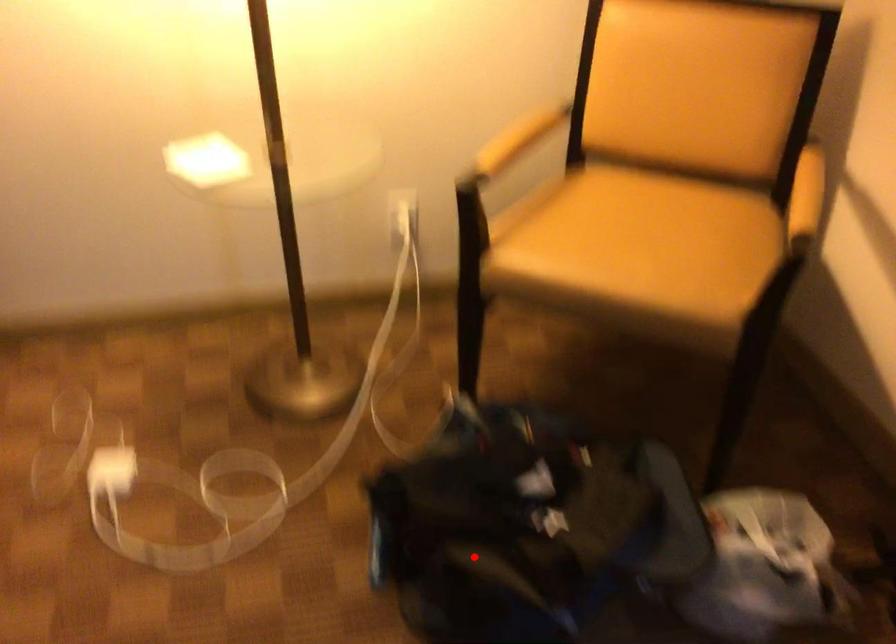
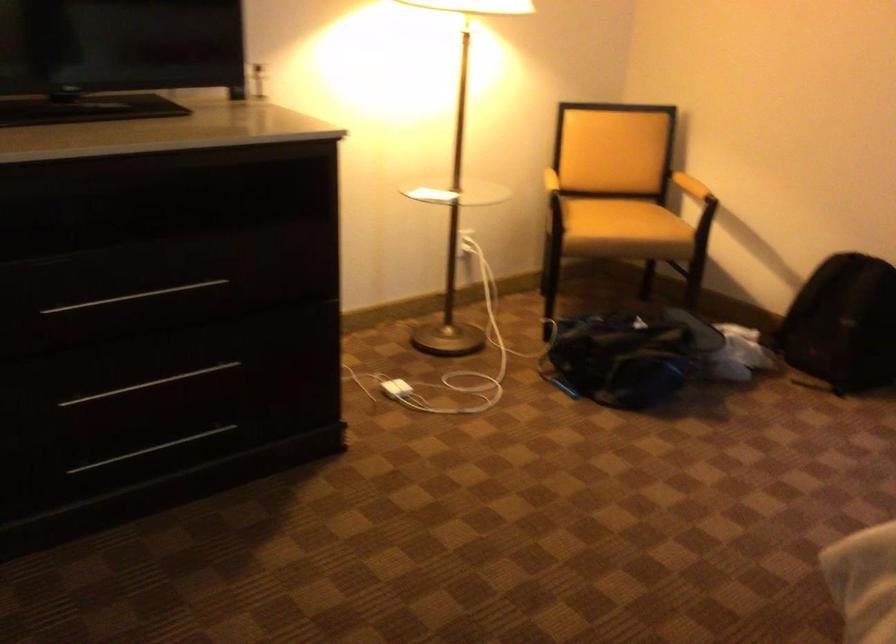
In the second image, find the point that corresponds to the highlighted location in the first image.

(627, 355)